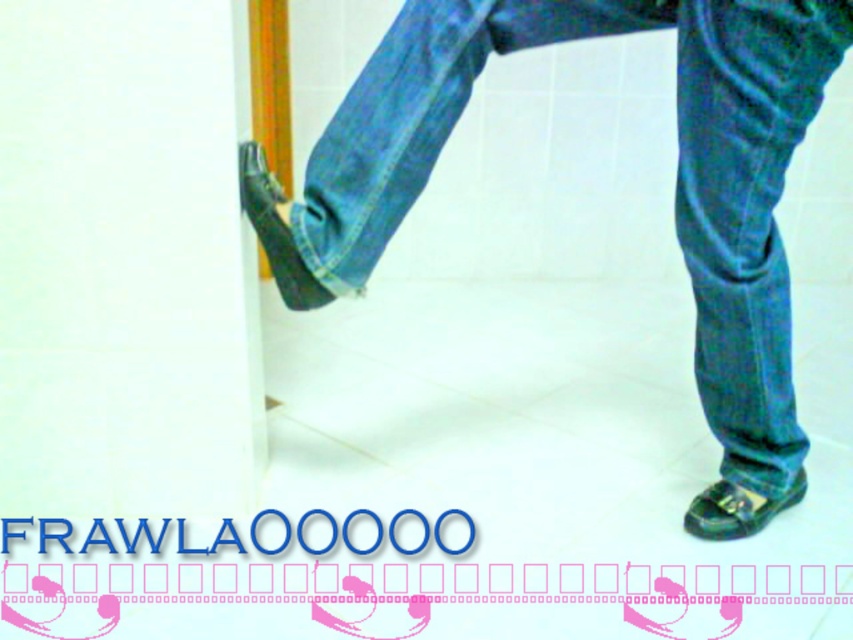
You are standing in a room with a wooden pole. You want to place a small plant pot exactly 1 meter away from the point where you are standing. Can you place it at point (x=689, y=136)?

The distance between point (x=689, y=136) and the viewer is 1.13 meters, so placing the plant pot there would be 0.13 meters farther than desired. Choose a closer spot instead.

You are a physical therapist assessing a patient who is trying to balance on a wooden pole. The patient is wearing a matte black shoe at lower left and a green leather shoe at lower right. Which shoe is more likely to provide better ankle support due to its height?

The matte black shoe at lower left is much taller than the green leather shoe at lower right, so it likely provides better ankle support due to its increased height.